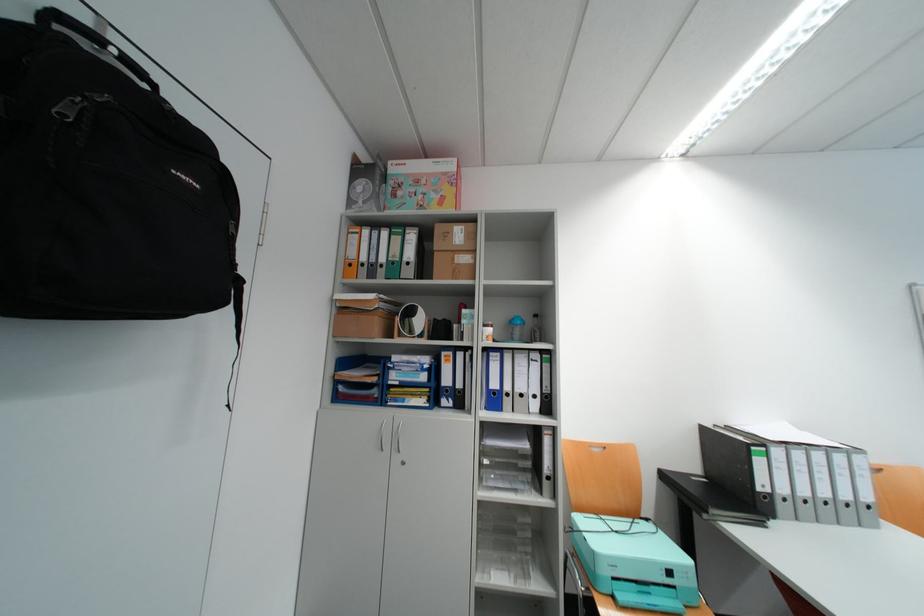
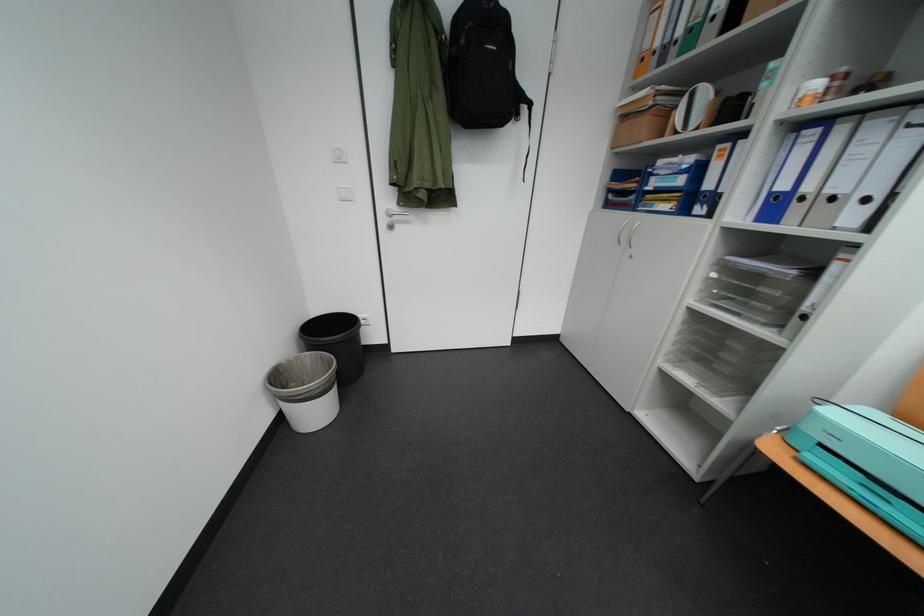
In the second image, find the point that corresponds to [508,389] in the first image.

(799, 190)